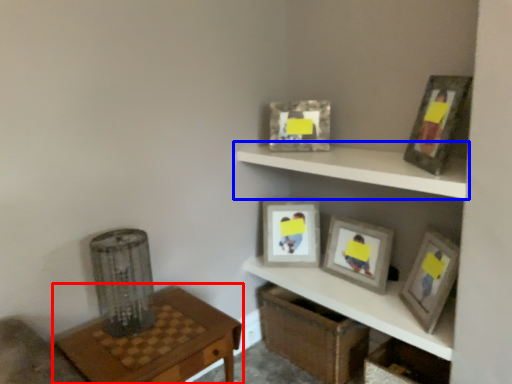
Question: Which of the following is the farthest to the observer, table (highlighted by a red box) or shelf (highlighted by a blue box)?

Choices:
 (A) table
 (B) shelf

Answer: (B)